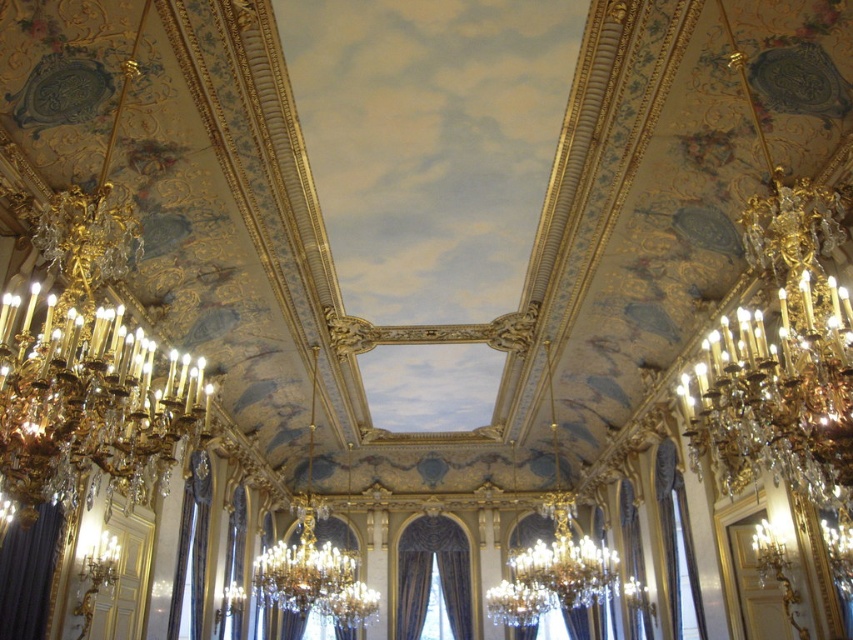
Question: Considering the relative positions of velvet drapery at center and dark blue velvet curtain at lower left in the image provided, where is velvet drapery at center located with respect to dark blue velvet curtain at lower left?

Choices:
 (A) below
 (B) above

Answer: (A)

Question: Does velvet drapery at center appear under dark blue velvet curtain at lower left?

Choices:
 (A) yes
 (B) no

Answer: (A)

Question: Does velvet drapery at center have a lesser width compared to dark blue velvet curtain at lower left?

Choices:
 (A) yes
 (B) no

Answer: (B)